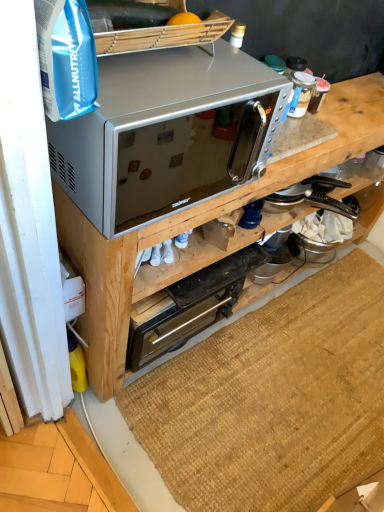
What is the approximate width of silver metallic microwave at upper center?

silver metallic microwave at upper center is 11.88 inches wide.

What do you see at coordinates (166, 133) in the screenshot?
I see `satin silver microwave at upper center` at bounding box center [166, 133].

Measure the distance between metallic stainless steel toaster oven at center and camera.

metallic stainless steel toaster oven at center is 1.26 meters away from camera.

You are a GUI agent. You are given a task and a screenshot of the screen. Output one action in this format:
    pyautogui.click(x=<x>, y=<y>)
    Task: Click on the brown woven mat at lower center
    Image resolution: width=384 pixels, height=512 pixels.
    Given the screenshot: What is the action you would take?
    pyautogui.click(x=273, y=399)

Is metallic stainless steel toaster oven at center spatially inside silver metallic microwave at upper center, or outside of it?

metallic stainless steel toaster oven at center exists entirely within silver metallic microwave at upper center.

Does metallic stainless steel toaster oven at center have a smaller size compared to silver metallic microwave at upper center?

Indeed, metallic stainless steel toaster oven at center has a smaller size compared to silver metallic microwave at upper center.

Does metallic stainless steel toaster oven at center turn towards silver metallic microwave at upper center?

Yes, metallic stainless steel toaster oven at center is facing silver metallic microwave at upper center.

From a real-world perspective, is metallic stainless steel toaster oven at center located higher than silver metallic microwave at upper center?

No, from a real-world perspective, metallic stainless steel toaster oven at center is not over silver metallic microwave at upper center

Which is more to the left, brown woven mat at lower center or metallic stainless steel toaster oven at center?

metallic stainless steel toaster oven at center is more to the left.

Is point (162, 441) more distant than point (178, 334)?

No, it is not.

Is brown woven mat at lower center positioned far away from metallic stainless steel toaster oven at center?

They are positioned close to each other.

Which object is positioned more to the left, brown woven mat at lower center or silver metallic microwave at upper center?

From the viewer's perspective, silver metallic microwave at upper center appears more on the left side.

Where is `doormat below the silver metallic microwave at upper center (from the image's perspective)`? doormat below the silver metallic microwave at upper center (from the image's perspective) is located at coordinates (273, 399).

From a real-world perspective, who is located lower, brown woven mat at lower center or silver metallic microwave at upper center?

From a 3D spatial view, brown woven mat at lower center is below.

Is point (283, 437) positioned in front of point (373, 92)?

Yes, it is in front of point (373, 92).

What are the coordinates of `cabinetry in front of the brown woven mat at lower center` in the screenshot? It's located at (196, 230).

From a real-world perspective, is silver metallic microwave at upper center positioned above or below brown woven mat at lower center?

In terms of real-world spatial position, silver metallic microwave at upper center is above brown woven mat at lower center.

Is silver metallic microwave at upper center not inside brown woven mat at lower center?

silver metallic microwave at upper center is positioned outside brown woven mat at lower center.

Is satin silver microwave at upper center oriented away from metallic stainless steel toaster oven at center?

satin silver microwave at upper center is not turned away from metallic stainless steel toaster oven at center.

Does satin silver microwave at upper center appear on the right side of metallic stainless steel toaster oven at center?

Indeed, satin silver microwave at upper center is positioned on the right side of metallic stainless steel toaster oven at center.

I want to click on appliance lying behind the satin silver microwave at upper center, so click(x=191, y=306).

Which object is positioned more to the left, satin silver microwave at upper center or silver metallic microwave at upper center?

From the viewer's perspective, satin silver microwave at upper center appears more on the left side.

Is satin silver microwave at upper center oriented towards silver metallic microwave at upper center?

No, satin silver microwave at upper center does not turn towards silver metallic microwave at upper center.

Which of these two, satin silver microwave at upper center or silver metallic microwave at upper center, is thinner?

Thinner between the two is silver metallic microwave at upper center.

Considering the relative sizes of metallic stainless steel toaster oven at center and brown woven mat at lower center in the image provided, is metallic stainless steel toaster oven at center thinner than brown woven mat at lower center?

Correct, the width of metallic stainless steel toaster oven at center is less than that of brown woven mat at lower center.

Between metallic stainless steel toaster oven at center and brown woven mat at lower center, which one is positioned behind?

metallic stainless steel toaster oven at center is more distant.

Is metallic stainless steel toaster oven at center positioned with its back to brown woven mat at lower center?

No.

From a real-world perspective, which is physically below, metallic stainless steel toaster oven at center or brown woven mat at lower center?

brown woven mat at lower center is physically lower.

At what (x,y) coordinates should I click in order to perform the action: click on cabinetry lying above the metallic stainless steel toaster oven at center (from the image's perspective). Please return your answer as a coordinate pair (x, y). Looking at the image, I should click on (196, 230).

Image resolution: width=384 pixels, height=512 pixels. Identify the location of appliance behind the brown woven mat at lower center. (191, 306).

Which object lies further to the anchor point brown woven mat at lower center, satin silver microwave at upper center or silver metallic microwave at upper center?

satin silver microwave at upper center.

Which object lies nearer to the anchor point brown woven mat at lower center, silver metallic microwave at upper center or metallic stainless steel toaster oven at center?

The object closer to brown woven mat at lower center is metallic stainless steel toaster oven at center.

Looking at the image, which one is located closer to brown woven mat at lower center, satin silver microwave at upper center or metallic stainless steel toaster oven at center?

metallic stainless steel toaster oven at center lies closer to brown woven mat at lower center than the other object.

Based on their spatial positions, is satin silver microwave at upper center or metallic stainless steel toaster oven at center closer to silver metallic microwave at upper center?

Based on the image, metallic stainless steel toaster oven at center appears to be nearer to silver metallic microwave at upper center.

Looking at the image, which one is located further to satin silver microwave at upper center, metallic stainless steel toaster oven at center or silver metallic microwave at upper center?

metallic stainless steel toaster oven at center is further to satin silver microwave at upper center.

Based on the photo, considering their positions, is silver metallic microwave at upper center positioned further to satin silver microwave at upper center than metallic stainless steel toaster oven at center?

metallic stainless steel toaster oven at center.

Which object lies further to the anchor point silver metallic microwave at upper center, satin silver microwave at upper center or brown woven mat at lower center?

brown woven mat at lower center is positioned further to the anchor silver metallic microwave at upper center.

From the image, which object appears to be nearer to brown woven mat at lower center, metallic stainless steel toaster oven at center or satin silver microwave at upper center?

The object closer to brown woven mat at lower center is metallic stainless steel toaster oven at center.

Find the location of a particular element. The image size is (384, 512). cabinetry between satin silver microwave at upper center and metallic stainless steel toaster oven at center along the z-axis is located at coordinates (196, 230).

Identify the location of appliance between satin silver microwave at upper center and brown woven mat at lower center in the up-down direction. The width and height of the screenshot is (384, 512). (191, 306).

Identify the location of cabinetry that lies between satin silver microwave at upper center and brown woven mat at lower center from top to bottom. (196, 230).

At what (x,y) coordinates should I click in order to perform the action: click on appliance between silver metallic microwave at upper center and brown woven mat at lower center in the up-down direction. Please return your answer as a coordinate pair (x, y). Looking at the image, I should click on (191, 306).